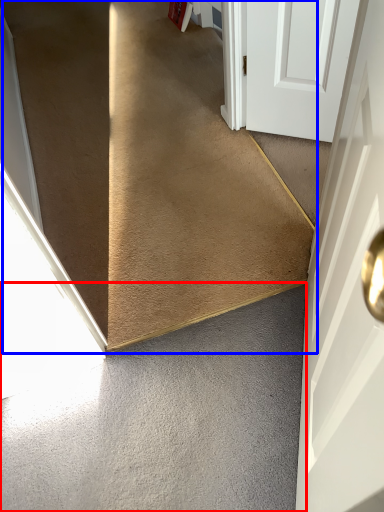
Question: Among these objects, which one is farthest to the camera, concrete (highlighted by a red box) or stairs (highlighted by a blue box)?

Choices:
 (A) concrete
 (B) stairs

Answer: (B)